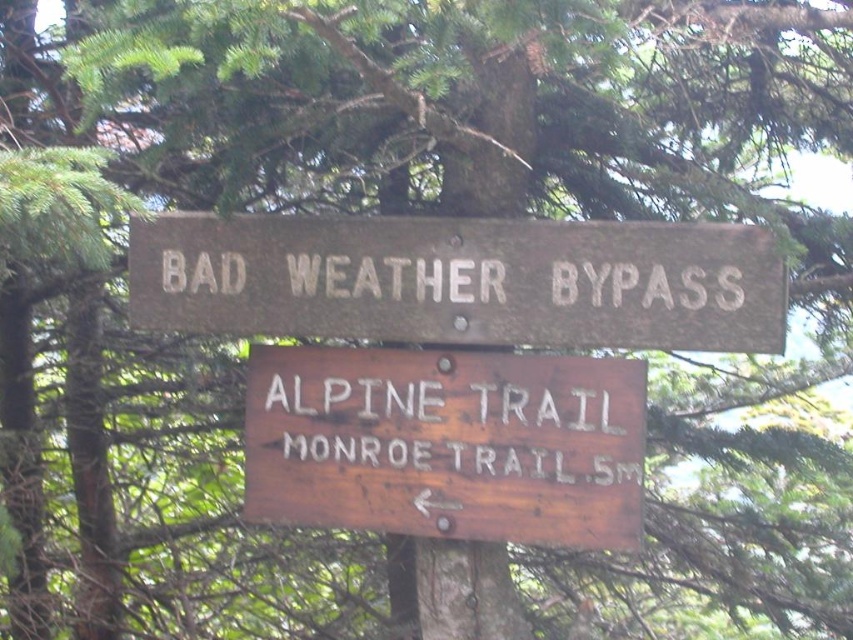
Question: Which point is farther to the camera?

Choices:
 (A) weathered wood sign at center
 (B) weathered wood sign at upper center

Answer: (A)

Question: Can you confirm if weathered wood sign at upper center is thinner than weathered wood sign at center?

Choices:
 (A) no
 (B) yes

Answer: (A)

Question: Among these objects, which one is farthest from the camera?

Choices:
 (A) weathered wood sign at center
 (B) weathered wood sign at upper center

Answer: (A)

Question: Does weathered wood sign at upper center appear on the left side of weathered wood sign at center?

Choices:
 (A) yes
 (B) no

Answer: (A)

Question: Does weathered wood sign at upper center appear over weathered wood sign at center?

Choices:
 (A) yes
 (B) no

Answer: (A)